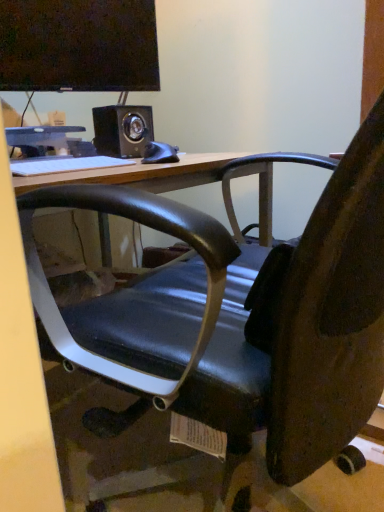
Find the location of a particular element. Image resolution: width=384 pixels, height=512 pixels. white matte keyboard at upper center is located at coordinates (64, 164).

What do you see at coordinates (122, 130) in the screenshot? Image resolution: width=384 pixels, height=512 pixels. I see `black matte speaker at upper center` at bounding box center [122, 130].

In order to face black matte speaker at upper center, should I rotate leftwards or rightwards?

It's best to rotate left around 8.947 degrees.

Locate an element on the screen. This screenshot has width=384, height=512. white glossy computer at upper left is located at coordinates (56, 151).

Identify the location of black matte mouse at center. The image size is (384, 512). (160, 153).

The image size is (384, 512). I want to click on speaker lying above the white glossy computer at upper left (from the image's perspective), so click(x=122, y=130).

Could you tell me if black matte speaker at upper center is turned towards white glossy computer at upper left?

No, black matte speaker at upper center does not turn towards white glossy computer at upper left.

From the image's perspective, which one is positioned lower, black matte speaker at upper center or white glossy computer at upper left?

white glossy computer at upper left is shown below in the image.

Is there a large distance between black matte speaker at upper center and white glossy computer at upper left?

No, black matte speaker at upper center is in close proximity to white glossy computer at upper left.

Does white matte keyboard at upper center have a greater height compared to black matte mouse at center?

In fact, white matte keyboard at upper center may be shorter than black matte mouse at center.

From the image's perspective, who appears lower, white matte keyboard at upper center or black matte mouse at center?

white matte keyboard at upper center, from the image's perspective.

Based on the photo, between white matte keyboard at upper center and black matte mouse at center, which one has larger width?

With larger width is white matte keyboard at upper center.

From a real-world perspective, is white matte keyboard at upper center below black matte mouse at center?

Yes, from a real-world perspective, white matte keyboard at upper center is below black matte mouse at center.

From the image's perspective, relative to black matte speaker at upper center, is white glossy computer at upper left above or below?

white glossy computer at upper left is below black matte speaker at upper center.

Is white glossy computer at upper left completely or partially outside of black matte speaker at upper center?

Yes, white glossy computer at upper left is not within black matte speaker at upper center.

Is white glossy computer at upper left not close to black matte speaker at upper center?

No, white glossy computer at upper left is in close proximity to black matte speaker at upper center.

From a real-world perspective, relative to black matte speaker at upper center, is white glossy computer at upper left vertically above or below?

white glossy computer at upper left is below black matte speaker at upper center.

Is point (22, 72) farther from camera compared to point (164, 160)?

Yes, point (22, 72) is farther from viewer.

Is matte black monitor at upper left far from black matte mouse at center?

No, matte black monitor at upper left is not far from black matte mouse at center.

Considering the relative positions of matte black monitor at upper left and black matte mouse at center in the image provided, is matte black monitor at upper left to the left of black matte mouse at center from the viewer's perspective?

Yes.

From the image's perspective, is matte black monitor at upper left over black matte mouse at center?

Yes, from the image's perspective, matte black monitor at upper left is on top of black matte mouse at center.

Consider the image. Is black matte speaker at upper center positioned in front of matte black monitor at upper left?

No, it is not.

Considering the sizes of objects black matte speaker at upper center and matte black monitor at upper left in the image provided, who is thinner, black matte speaker at upper center or matte black monitor at upper left?

Thinner between the two is matte black monitor at upper left.

Is there a large distance between black matte speaker at upper center and matte black monitor at upper left?

That's not correct — black matte speaker at upper center is a little close to matte black monitor at upper left.

Considering the relative positions of black matte speaker at upper center and matte black monitor at upper left in the image provided, is black matte speaker at upper center to the left of matte black monitor at upper left from the viewer's perspective?

In fact, black matte speaker at upper center is to the right of matte black monitor at upper left.

Which of these two, matte black monitor at upper left or black matte speaker at upper center, stands taller?

Standing taller between the two is matte black monitor at upper left.

Is matte black monitor at upper left facing towards black matte speaker at upper center?

No, matte black monitor at upper left is not aimed at black matte speaker at upper center.

Considering the positions of point (142, 147) and point (33, 160), is point (142, 147) closer or farther from the camera than point (33, 160)?

Point (142, 147) is farther from the camera than point (33, 160).

Is black matte speaker at upper center in contact with white matte keyboard at upper center?

They are not placed beside each other.

Between black matte speaker at upper center and white matte keyboard at upper center, which one has smaller width?

With smaller width is white matte keyboard at upper center.

Locate an element on the screen. computer directly beneath the black matte speaker at upper center (from a real-world perspective) is located at coordinates (56, 151).

This screenshot has height=512, width=384. There is a white matte keyboard at upper center. Find the location of `equipment above it (from a real-world perspective)`. equipment above it (from a real-world perspective) is located at coordinates (160, 153).

Which object lies further to the anchor point black matte speaker at upper center, matte black monitor at upper left or white glossy computer at upper left?

matte black monitor at upper left lies further to black matte speaker at upper center than the other object.

Looking at this image, from the image, which object appears to be farther from black matte mouse at center, matte black monitor at upper left or black matte speaker at upper center?

matte black monitor at upper left is positioned further to the anchor black matte mouse at center.

Consider the image. Looking at the image, which one is located closer to black matte mouse at center, white glossy computer at upper left or matte black monitor at upper left?

The object closer to black matte mouse at center is white glossy computer at upper left.

Considering their positions, is white matte keyboard at upper center positioned closer to white glossy computer at upper left than black matte speaker at upper center?

The object closer to white glossy computer at upper left is white matte keyboard at upper center.

Considering their positions, is white matte keyboard at upper center positioned closer to black matte mouse at center than black matte speaker at upper center?

black matte speaker at upper center.

Based on their spatial positions, is black matte speaker at upper center or matte black monitor at upper left further from white matte keyboard at upper center?

The object further to white matte keyboard at upper center is matte black monitor at upper left.

Estimate the real-world distances between objects in this image. Which object is further from black matte speaker at upper center, matte black monitor at upper left or black matte mouse at center?

Among the two, matte black monitor at upper left is located further to black matte speaker at upper center.

Looking at the image, which one is located further to white glossy computer at upper left, matte black monitor at upper left or black matte speaker at upper center?

matte black monitor at upper left is positioned further to the anchor white glossy computer at upper left.

Image resolution: width=384 pixels, height=512 pixels. Find the location of `keyboard between white glossy computer at upper left and black matte mouse at center in the horizontal direction`. keyboard between white glossy computer at upper left and black matte mouse at center in the horizontal direction is located at coordinates (64, 164).

At what (x,y) coordinates should I click in order to perform the action: click on equipment between matte black monitor at upper left and white matte keyboard at upper center in the up-down direction. Please return your answer as a coordinate pair (x, y). Looking at the image, I should click on (160, 153).

This screenshot has height=512, width=384. Identify the location of equipment between white matte keyboard at upper center and black matte speaker at upper center in the front-back direction. point(160,153).

At what (x,y) coordinates should I click in order to perform the action: click on speaker between matte black monitor at upper left and white glossy computer at upper left vertically. Please return your answer as a coordinate pair (x, y). The image size is (384, 512). Looking at the image, I should click on (122, 130).